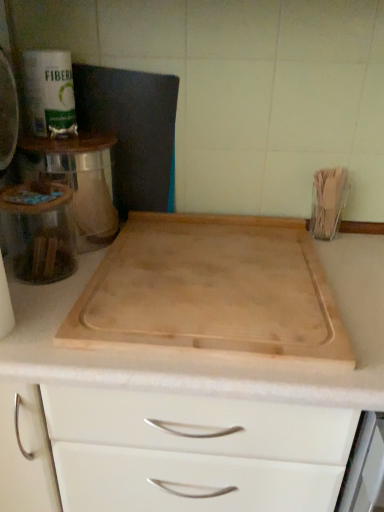
Question: From the image's perspective, is natural wood cutting board at center under natural wood cutting board at center?

Choices:
 (A) yes
 (B) no

Answer: (A)

Question: Is natural wood cutting board at center at the left side of natural wood cutting board at center?

Choices:
 (A) yes
 (B) no

Answer: (B)

Question: Can you confirm if natural wood cutting board at center is smaller than natural wood cutting board at center?

Choices:
 (A) yes
 (B) no

Answer: (B)

Question: Can natural wood cutting board at center be found inside natural wood cutting board at center?

Choices:
 (A) no
 (B) yes

Answer: (B)

Question: Can you confirm if natural wood cutting board at center is taller than natural wood cutting board at center?

Choices:
 (A) no
 (B) yes

Answer: (B)

Question: Can you confirm if natural wood cutting board at center is bigger than natural wood cutting board at center?

Choices:
 (A) no
 (B) yes

Answer: (B)

Question: From the image's perspective, is metallic silver toaster at upper left, which ranks as the 2th appliance in right-to-left order, located above natural wood cutting board at center?

Choices:
 (A) no
 (B) yes

Answer: (B)

Question: Can you confirm if metallic silver toaster at upper left, which ranks as the 2th appliance in right-to-left order, is smaller than natural wood cutting board at center?

Choices:
 (A) no
 (B) yes

Answer: (B)

Question: Is metallic silver toaster at upper left, which ranks as the 2th appliance in right-to-left order, shorter than natural wood cutting board at center?

Choices:
 (A) no
 (B) yes

Answer: (A)

Question: Does metallic silver toaster at upper left, which ranks as the 2th appliance in right-to-left order, have a larger size compared to natural wood cutting board at center?

Choices:
 (A) no
 (B) yes

Answer: (A)

Question: Does metallic silver toaster at upper left, which ranks as the 2th appliance in right-to-left order, come in front of natural wood cutting board at center?

Choices:
 (A) yes
 (B) no

Answer: (B)

Question: Is natural wood cutting board at center at the back of metallic silver toaster at upper left, which is the first appliance from left to right?

Choices:
 (A) yes
 (B) no

Answer: (B)

Question: From a real-world perspective, does metallic silver toaster at upper left, which is the first appliance from left to right, stand above natural wood cutting board at center?

Choices:
 (A) no
 (B) yes

Answer: (B)